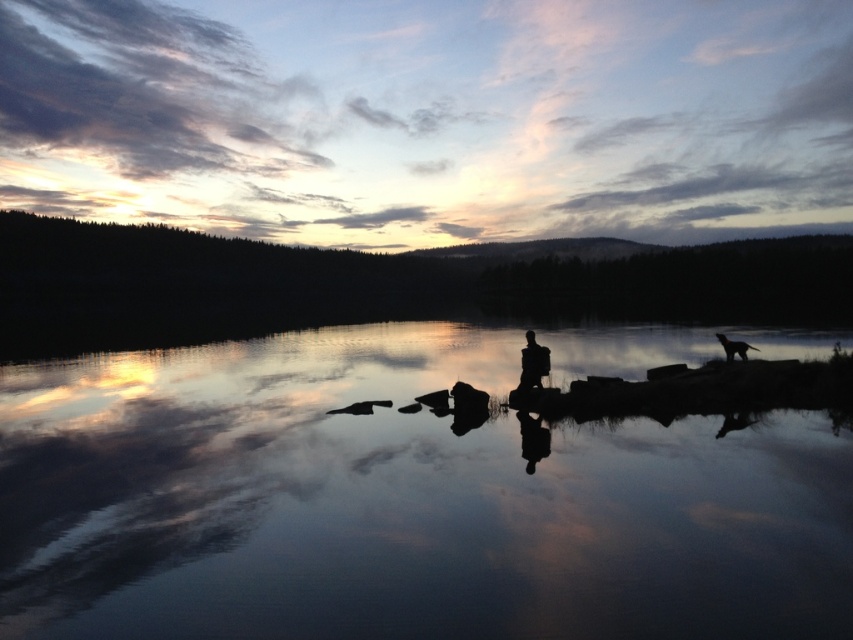
Between smooth reflective water at center and silhouette figure at center, which one is positioned lower?

Positioned lower is smooth reflective water at center.

Is smooth reflective water at center taller than silhouette figure at center?

Indeed, smooth reflective water at center has a greater height compared to silhouette figure at center.

Who is more forward, (450, 465) or (544, 362)?

Point (450, 465) is in front.

Where is `smooth reflective water at center`? smooth reflective water at center is located at coordinates (399, 502).

Does point (560, 496) come farther from viewer compared to point (751, 348)?

No, (560, 496) is in front of (751, 348).

Is smooth reflective water at center further to the viewer compared to silhouette figure at right?

No, it is in front of silhouette figure at right.

At what (x,y) coordinates should I click in order to perform the action: click on smooth reflective water at center. Please return your answer as a coordinate pair (x, y). This screenshot has height=640, width=853. Looking at the image, I should click on (399, 502).

Is silhouette figure at center shorter than silhouette figure at right?

No.

Between point (529, 381) and point (753, 346), which one is positioned behind?

Positioned behind is point (753, 346).

Describe the element at coordinates (532, 362) in the screenshot. I see `silhouette figure at center` at that location.

Where is `silhouette figure at center`? The width and height of the screenshot is (853, 640). silhouette figure at center is located at coordinates (532, 362).